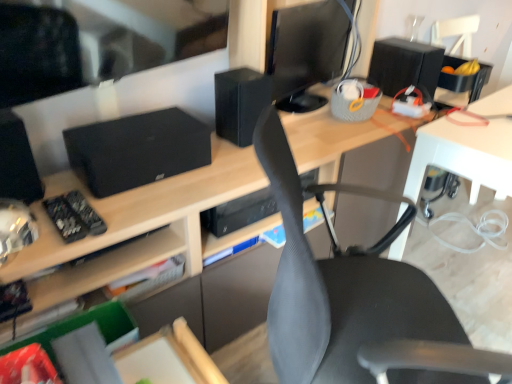
Question: In terms of width, does black matte speaker at upper center, which ranks as the second speaker in back-to-front order, look wider or thinner when compared to black glossy monitor at upper center?

Choices:
 (A) wide
 (B) thin

Answer: (A)

Question: Considering their positions, is black matte speaker at upper center, placed as the second speaker when sorted from left to right, located in front of or behind black glossy monitor at upper center?

Choices:
 (A) behind
 (B) front

Answer: (A)

Question: Which object is positioned closest to the black glossy monitor at upper center?

Choices:
 (A) black matte speaker at upper center, which is the 2th speaker from right to left
 (B) black matte speaker at left, placed as the first speaker when sorted from front to back
 (C) matte wood desk at center
 (D) gray mesh chair at center
 (E) black matte remote control at left

Answer: (A)

Question: Which is farther from the black glossy monitor at upper center?

Choices:
 (A) black matte remote control at left
 (B) gray mesh chair at center
 (C) black matte speaker at upper center, marked as the second speaker in a front-to-back arrangement
 (D) black matte speaker at upper right, placed as the first speaker when sorted from right to left
 (E) matte wood desk at center

Answer: (A)